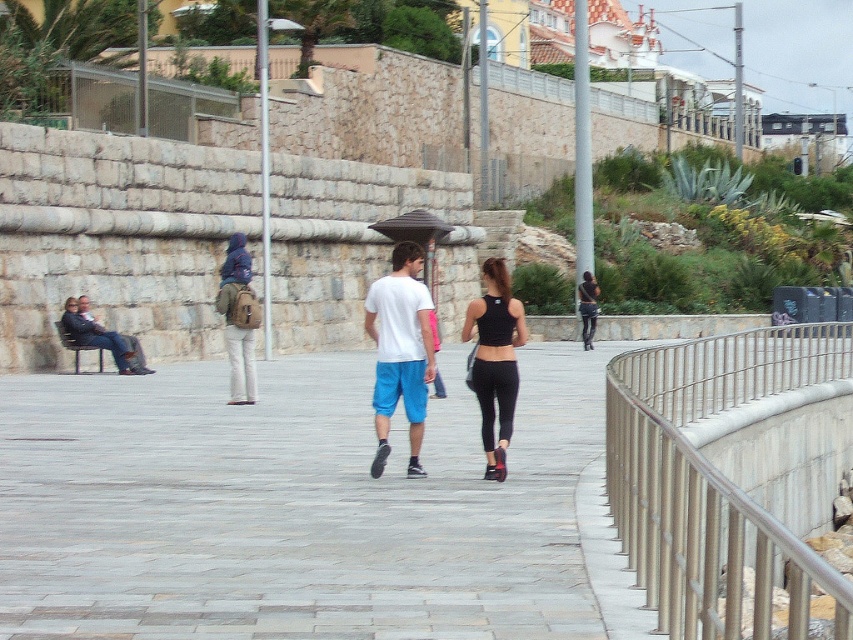
Is matte brown backpack at center thinner than black leather pants at center?

Incorrect, matte brown backpack at center's width is not less than black leather pants at center's.

Is point (250, 346) less distant than point (593, 300)?

That is True.

The image size is (853, 640). I want to click on matte brown backpack at center, so [239, 320].

Who is positioned more to the left, white cotton t-shirt at center or black matte tank top at center?

white cotton t-shirt at center is more to the left.

Between point (395, 396) and point (514, 356), which one is positioned behind?

The point (395, 396) is behind.

This screenshot has height=640, width=853. Identify the location of white cotton t-shirt at center. tap(399, 349).

The height and width of the screenshot is (640, 853). Describe the element at coordinates (399, 349) in the screenshot. I see `white cotton t-shirt at center` at that location.

Consider the image. Which is more to the left, white cotton t-shirt at center or black leather pants at center?

Positioned to the left is white cotton t-shirt at center.

Between point (378, 292) and point (589, 314), which one is positioned in front?

Point (378, 292) is more forward.

You are a GUI agent. You are given a task and a screenshot of the screen. Output one action in this format:
    pyautogui.click(x=<x>, y=<y>)
    Task: Click on the white cotton t-shirt at center
    Image resolution: width=853 pixels, height=640 pixels.
    Given the screenshot: What is the action you would take?
    pyautogui.click(x=399, y=349)